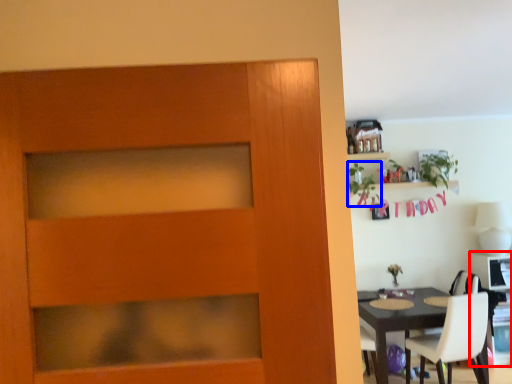
Question: Among these objects, which one is nearest to the camera, computer desk (highlighted by a red box) or plant (highlighted by a blue box)?

Choices:
 (A) computer desk
 (B) plant

Answer: (B)